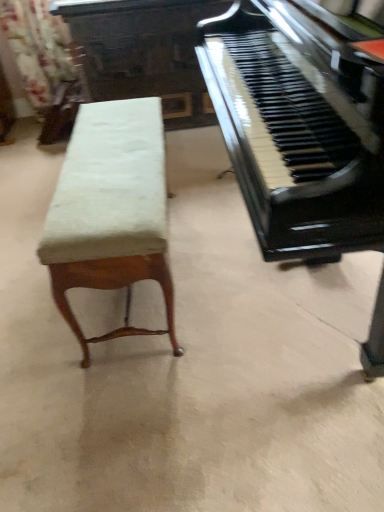
Question: In the image, is velvet upholstered bench at left on the left side or the right side of black polished wood piano at right?

Choices:
 (A) left
 (B) right

Answer: (A)

Question: Relative to black polished wood piano at right, is velvet upholstered bench at left in front or behind?

Choices:
 (A) front
 (B) behind

Answer: (B)

Question: Estimate the real-world distances between objects in this image. Which object is closer to the floral fabric curtain at upper left?

Choices:
 (A) black polished wood piano at right
 (B) velvet upholstered bench at left

Answer: (B)

Question: Which of these objects is positioned closest to the floral fabric curtain at upper left?

Choices:
 (A) black polished wood piano at right
 (B) velvet upholstered bench at left

Answer: (B)